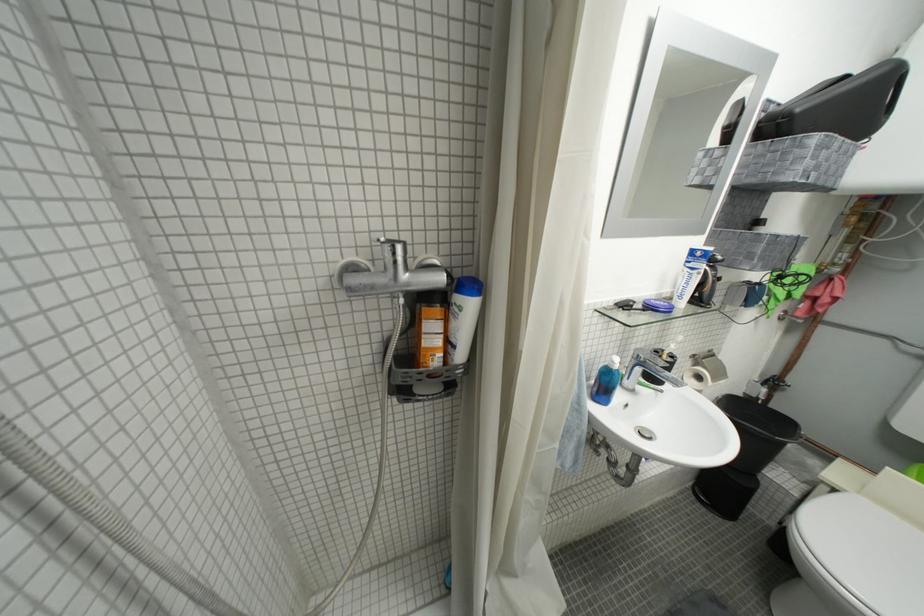
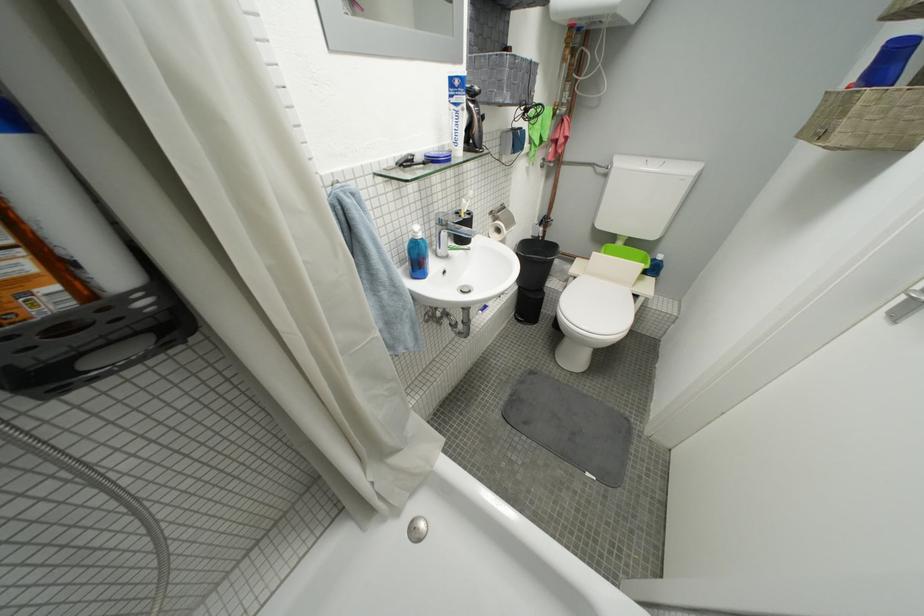
Locate, in the second image, the point that corresponds to point (699, 493) in the first image.

(523, 322)